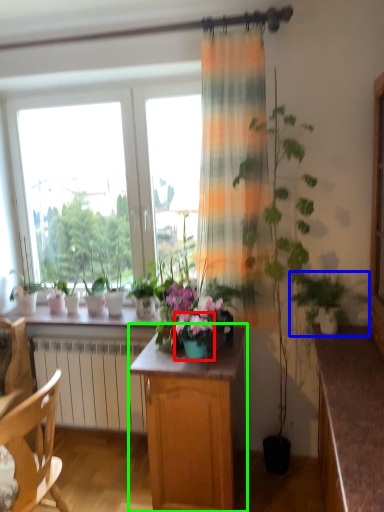
Question: Which object is positioned farthest from flower box (highlighted by a red box)? Select from houseplant (highlighted by a blue box) and cabinetry (highlighted by a green box).

Choices:
 (A) houseplant
 (B) cabinetry

Answer: (A)